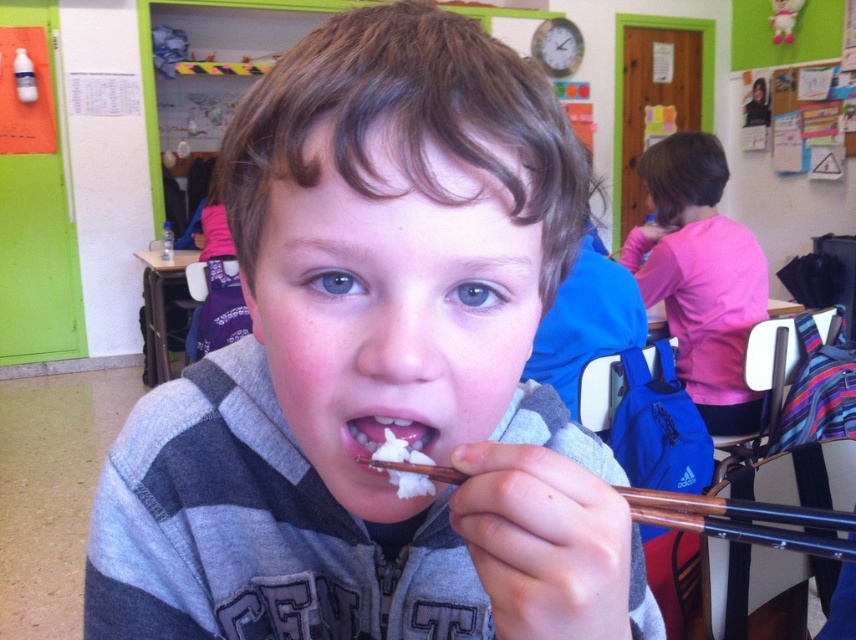
Does pink fabric shirt at upper right come in front of brown wood chopstick at lower center?

No, pink fabric shirt at upper right is further to the viewer.

You are a GUI agent. You are given a task and a screenshot of the screen. Output one action in this format:
    pyautogui.click(x=<x>, y=<y>)
    Task: Click on the pink fabric shirt at upper right
    
    Given the screenshot: What is the action you would take?
    pyautogui.click(x=700, y=275)

In order to click on pink fabric shirt at upper right in this screenshot , I will do `click(700, 275)`.

Identify the location of pink fabric shirt at upper right. This screenshot has width=856, height=640. 700,275.

Is white matte food at center wider than white fluffy rice at mouth?

Correct, the width of white matte food at center exceeds that of white fluffy rice at mouth.

Is white matte food at center taller than white fluffy rice at mouth?

Correct, white matte food at center is much taller as white fluffy rice at mouth.

The image size is (856, 640). I want to click on white matte food at center, so click(x=393, y=436).

Find the location of a particular element. white matte food at center is located at coordinates (393, 436).

Who is more forward, (841, 541) or (403, 454)?

Point (841, 541) is in front.

Who is shorter, brown wood chopstick at lower center or white fluffy rice at mouth?

With less height is white fluffy rice at mouth.

Is point (704, 500) farther from viewer compared to point (421, 474)?

No, (704, 500) is in front of (421, 474).

Locate an element on the screen. brown wood chopstick at lower center is located at coordinates (744, 520).